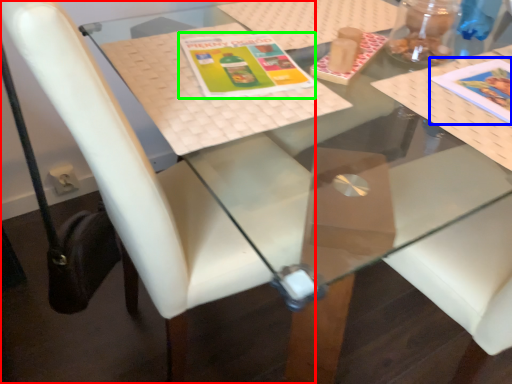
Question: Which object is positioned farthest from chair (highlighted by a red box)? Select from book cover (highlighted by a blue box) and book cover (highlighted by a green box).

Choices:
 (A) book cover
 (B) book cover

Answer: (A)